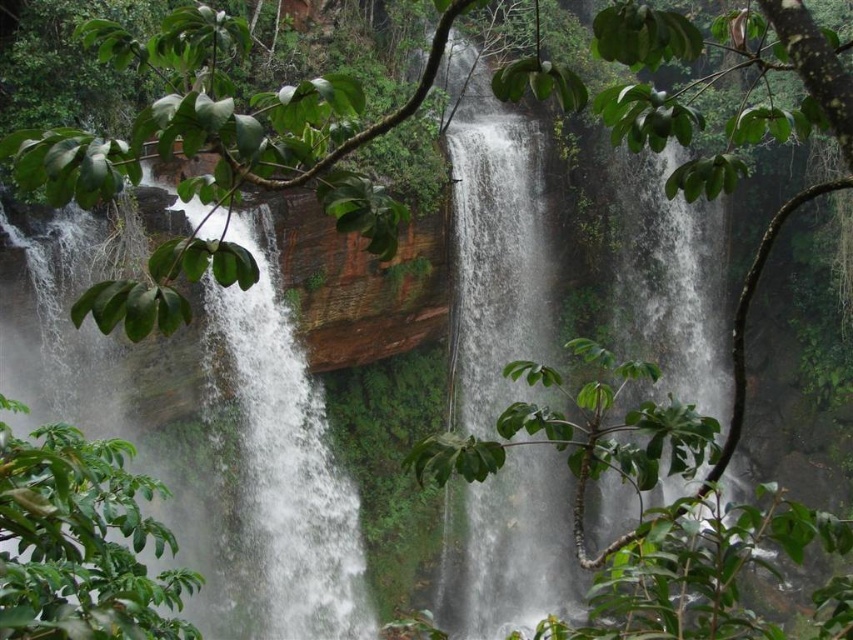
You are a hiker standing at the base of the waterfall. You notice the white frothy water at center and the green leafy tree at lower left. Which object is higher in the scene?

The white frothy water at center is located above the green leafy tree at lower left, so it is higher in the scene.

You are a hiker trying to cross a narrow path near the white frothy water at center and the green leafy tree at lower left. The path is 25 meters wide. Can you safely cross the path without getting too close to either object?

The distance between the white frothy water at center and the green leafy tree at lower left is 26.01 meters. Since the path is only 25 meters wide, you cannot safely cross without getting too close to either object.